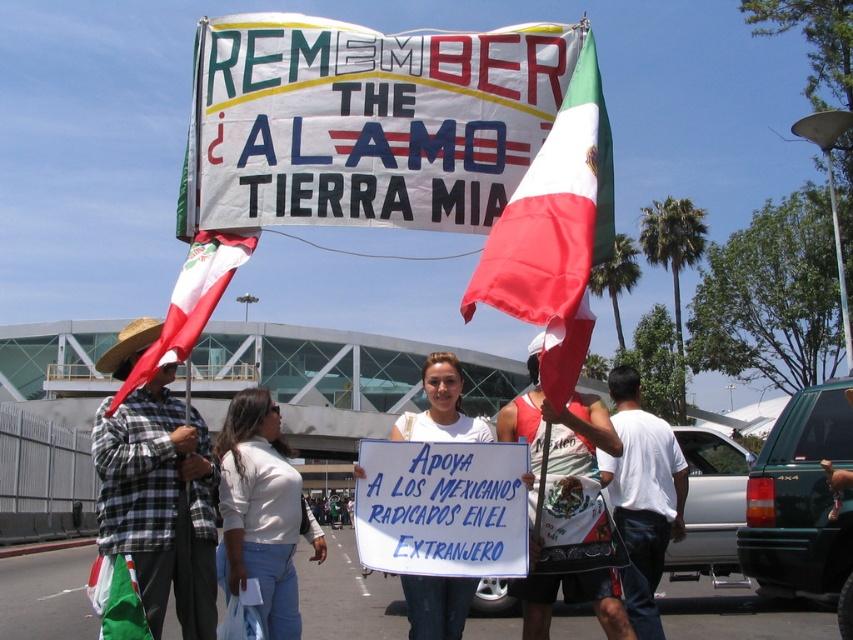
Question: Which of these objects is positioned closest to the white cotton shirt at lower right?

Choices:
 (A) red and white striped flag at left
 (B) red fabric flag at center
 (C) checkered fabric shirt at left

Answer: (B)

Question: Is white fabric flag at center to the right of red and white striped flag at left from the viewer's perspective?

Choices:
 (A) yes
 (B) no

Answer: (A)

Question: Which point is farther to the camera?

Choices:
 (A) (607, 461)
 (B) (178, 276)

Answer: (B)

Question: Among these objects, which one is nearest to the camera?

Choices:
 (A) white fabric flag at center
 (B) red and white striped flag at left
 (C) white cotton shirt at lower right
 (D) checkered fabric shirt at left

Answer: (A)

Question: Can you confirm if white fabric flag at center is thinner than white cotton shirt at lower right?

Choices:
 (A) yes
 (B) no

Answer: (A)

Question: Can you confirm if white fabric flag at center is positioned to the right of red and white striped flag at left?

Choices:
 (A) yes
 (B) no

Answer: (A)